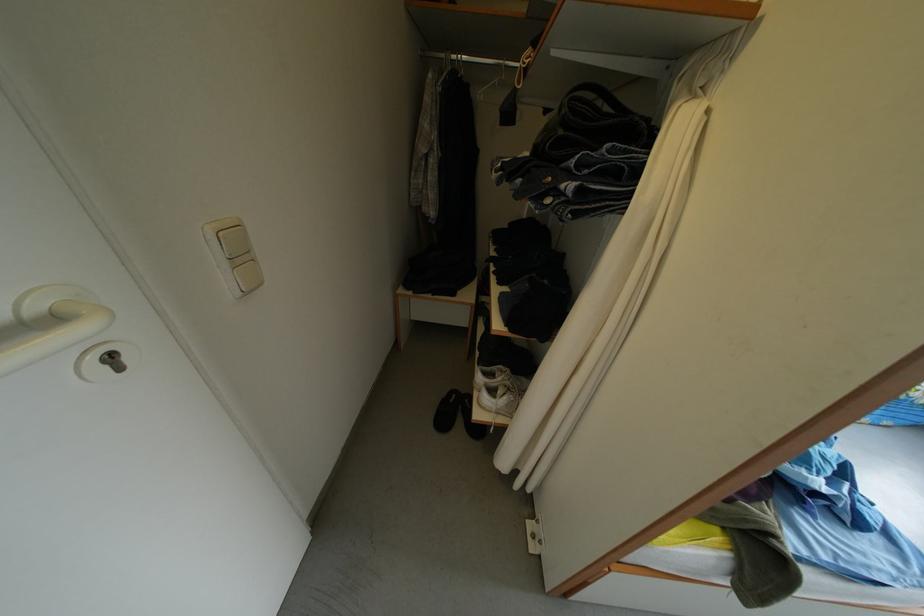
You are a GUI agent. You are given a task and a screenshot of the screen. Output one action in this format:
    pyautogui.click(x=<x>, y=<y>)
    Task: Click on the light switch
    The image size is (924, 616).
    Given the screenshot: What is the action you would take?
    pyautogui.click(x=237, y=256)